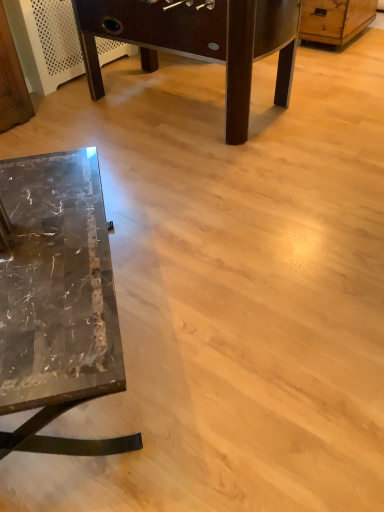
The height and width of the screenshot is (512, 384). In order to click on vacant space in front of marble table at lower left, which is the 1th table in top-to-bottom order in this screenshot , I will do `click(216, 202)`.